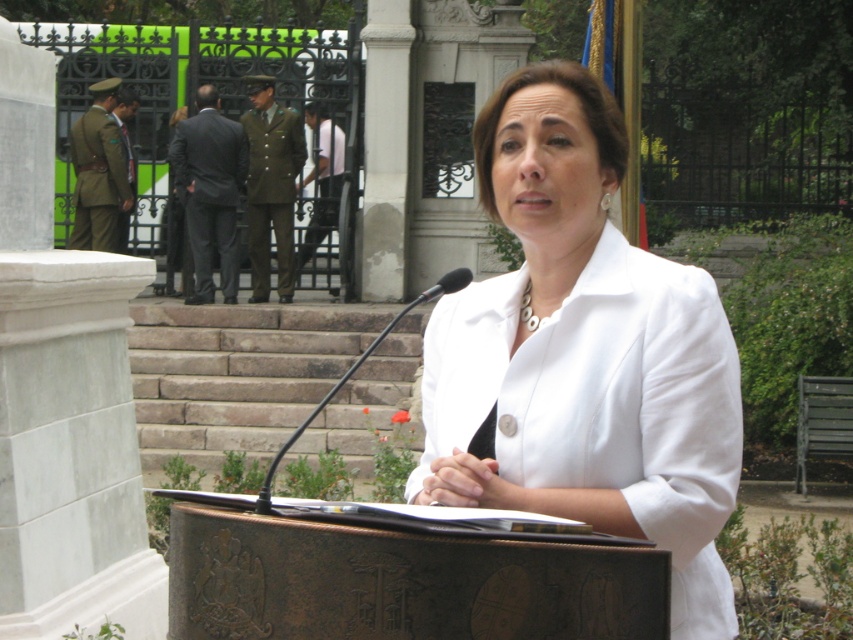
You are a photographer at the event and need to capture a photo that includes both the white matte jacket at center and the green fabric uniform at left. Based on their positions, which side of the frame should you focus on to ensure both are visible?

The white matte jacket at center is positioned on the right side of green fabric uniform at left, so focusing the camera on the center of the frame will ensure both the white matte jacket at center and the green fabric uniform at left are visible.

You are a photographer positioned at a certain distance from the white matte jacket at center. You need to capture a clear photo of the jacket without including the gate or the bus in the background. Given that the gate and bus are farther away than the jacket, can you adjust your camera angle to exclude them?

The white matte jacket at center is only 4.01 meters away from the viewer. Since the gate and bus are farther away, you can lower your camera angle to focus on the jacket while blocking the background elements with the podium or other foreground objects.